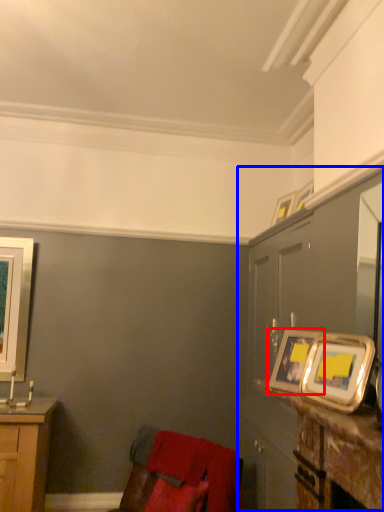
Question: Which object appears closest to the camera in this image, picture frame (highlighted by a red box) or dresser (highlighted by a blue box)?

Choices:
 (A) picture frame
 (B) dresser

Answer: (A)